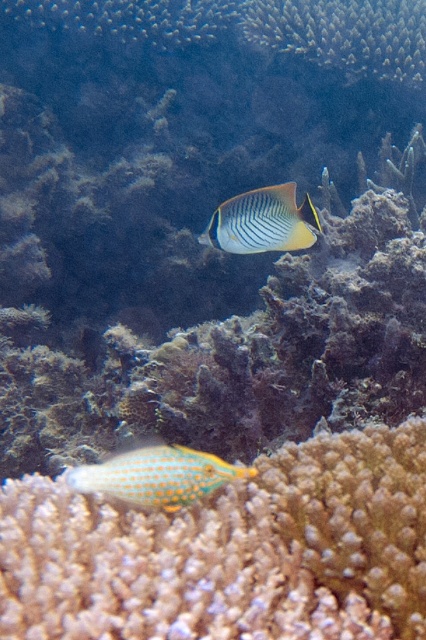
Does orange speckled fish at lower left have a greater width compared to striped yellow fish at center?

Incorrect, orange speckled fish at lower left's width does not surpass striped yellow fish at center's.

Consider the image. Is orange speckled fish at lower left above striped yellow fish at center?

Actually, orange speckled fish at lower left is below striped yellow fish at center.

Find the location of a particular element. This screenshot has height=640, width=426. orange speckled fish at lower left is located at coordinates (158, 476).

Who is more distant from viewer, (106, 556) or (146, 458)?

Positioned behind is point (146, 458).

Does orange spotted coral at lower center have a lesser height compared to orange speckled fish at lower left?

No, orange spotted coral at lower center is not shorter than orange speckled fish at lower left.

Describe the element at coordinates (230, 552) in the screenshot. I see `orange spotted coral at lower center` at that location.

Locate an element on the screen. The width and height of the screenshot is (426, 640). orange spotted coral at lower center is located at coordinates (230, 552).

Who is shorter, orange spotted coral at lower center or striped yellow fish at center?

striped yellow fish at center

The width and height of the screenshot is (426, 640). I want to click on orange spotted coral at lower center, so click(x=230, y=552).